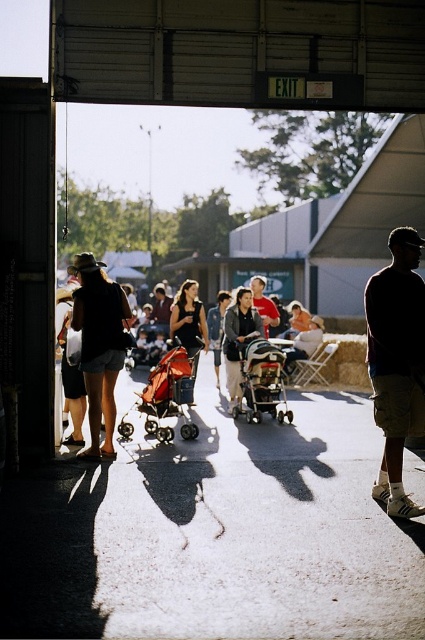
From the picture: Can you confirm if dark brown cargo shorts at right is smaller than matte red stroller at center?

Indeed, dark brown cargo shorts at right has a smaller size compared to matte red stroller at center.

At what (x,y) coordinates should I click in order to perform the action: click on dark brown cargo shorts at right. Please return your answer as a coordinate pair (x, y). Looking at the image, I should click on point(396,362).

Does dark brown cargo shorts at right have a lesser height compared to dark brown leather jacket at center?

In fact, dark brown cargo shorts at right may be taller than dark brown leather jacket at center.

Which is more to the left, dark brown cargo shorts at right or dark brown leather jacket at center?

dark brown leather jacket at center

The image size is (425, 640). What do you see at coordinates (396, 362) in the screenshot?
I see `dark brown cargo shorts at right` at bounding box center [396, 362].

You are a GUI agent. You are given a task and a screenshot of the screen. Output one action in this format:
    pyautogui.click(x=<x>, y=<y>)
    Task: Click on the dark brown cargo shorts at right
    The image size is (425, 640).
    Given the screenshot: What is the action you would take?
    pyautogui.click(x=396, y=362)

Looking at this image, can you confirm if dark brown cargo shorts at right is shorter than matte black stroller at center?

In fact, dark brown cargo shorts at right may be taller than matte black stroller at center.

Is dark brown cargo shorts at right to the right of matte black stroller at center from the viewer's perspective?

Indeed, dark brown cargo shorts at right is positioned on the right side of matte black stroller at center.

This screenshot has height=640, width=425. I want to click on dark brown cargo shorts at right, so click(396, 362).